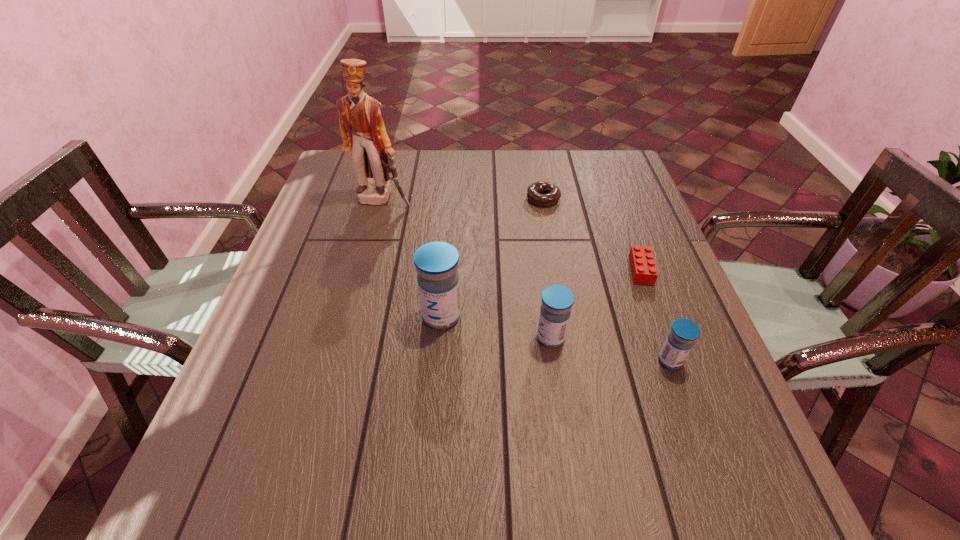
I want to click on the fifth object from right to left, so click(x=436, y=263).

Locate an element on the screen. The image size is (960, 540). the leftmost medicine is located at coordinates (436, 263).

The image size is (960, 540). I want to click on the second shortest medicine, so click(x=557, y=300).

The image size is (960, 540). I want to click on the second medicine from left to right, so click(557, 300).

Find the location of `the nearest object`. the nearest object is located at coordinates (680, 340).

The width and height of the screenshot is (960, 540). I want to click on the nearest medicine, so click(x=680, y=340).

This screenshot has width=960, height=540. I want to click on doughnut, so click(552, 194).

Locate an element on the screen. Image resolution: width=960 pixels, height=540 pixels. the tallest object is located at coordinates (363, 131).

The image size is (960, 540). Identify the location of the leftmost object. (363, 131).

You are a GUI agent. You are given a task and a screenshot of the screen. Output one action in this format:
    pyautogui.click(x=<x>, y=<y>)
    Task: Click on the Lego
    This screenshot has height=540, width=960.
    Given the screenshot: What is the action you would take?
    pyautogui.click(x=642, y=263)